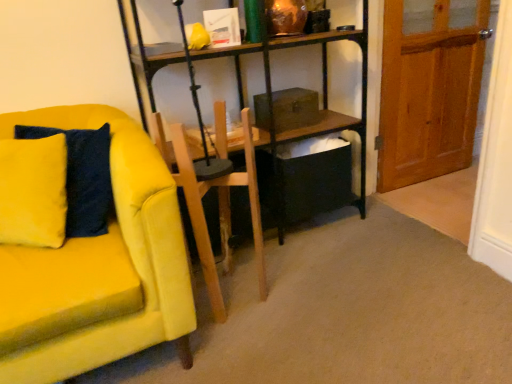
Question: From the image's perspective, is wooden armchair at center positioned above or below wooden at right?

Choices:
 (A) below
 (B) above

Answer: (A)

Question: Is wooden armchair at center taller or shorter than wooden at right?

Choices:
 (A) short
 (B) tall

Answer: (A)

Question: Estimate the real-world distances between objects in this image. Which object is closer to the wooden armchair at center?

Choices:
 (A) velvet yellow pillow at left
 (B) velvet yellow couch at left
 (C) wooden at right

Answer: (B)

Question: Estimate the real-world distances between objects in this image. Which object is closer to the wooden at right?

Choices:
 (A) wooden armchair at center
 (B) velvet yellow couch at left
 (C) velvet yellow pillow at left

Answer: (A)